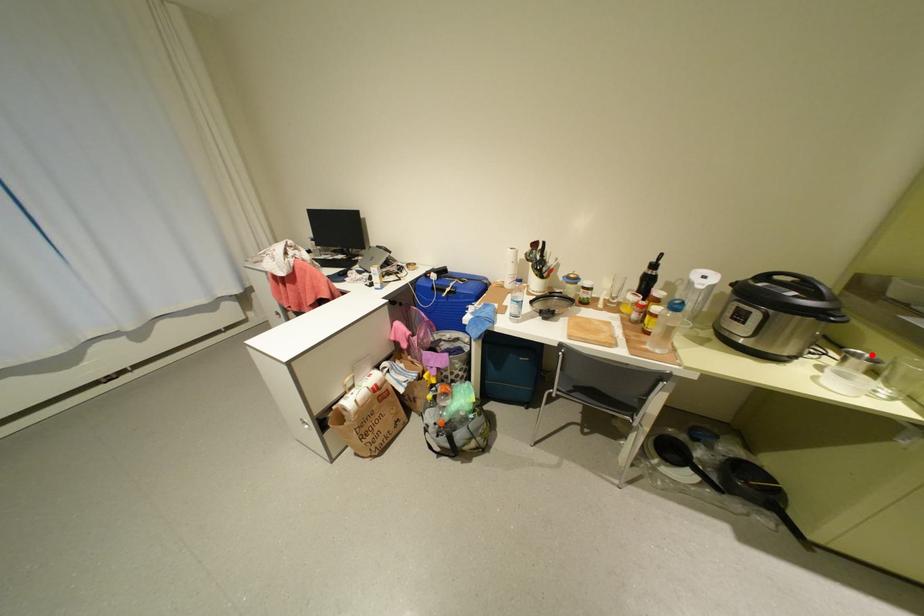
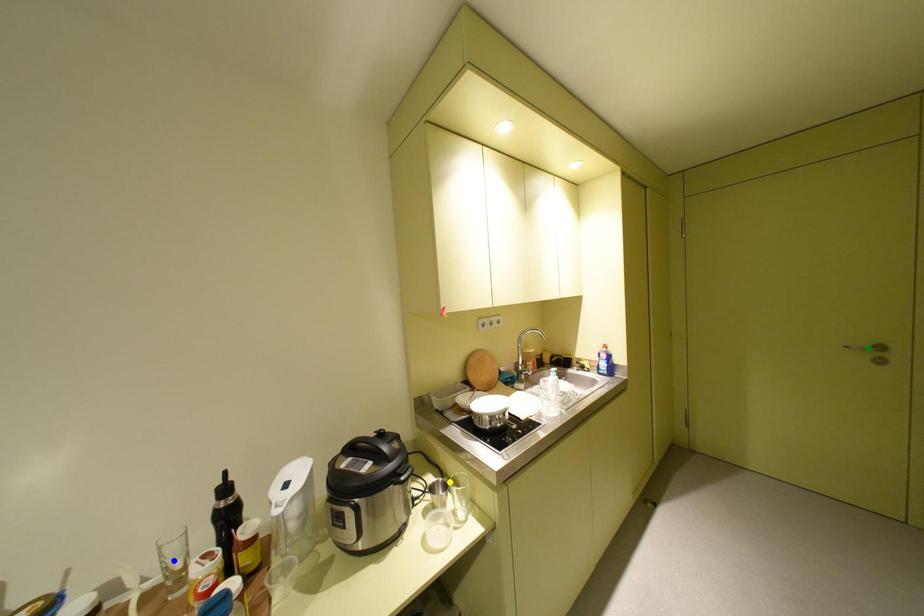
Question: I am providing you with two images of the same scene from different viewpoints. A red point is marked on the first image. You are given multiple points on the second image. Which point in image 2 represents the same 3d spot as the red point in image 1?

Choices:
 (A) blue point
 (B) yellow point
 (C) green point

Answer: (B)